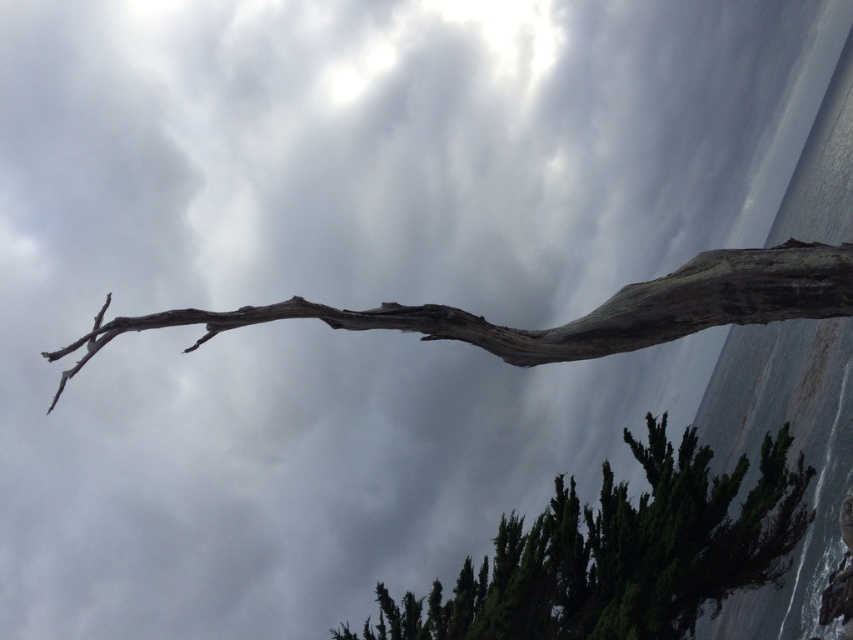
Between dark green leafy tree at lower right and gray rough bark branch at upper center, which one appears on the right side from the viewer's perspective?

gray rough bark branch at upper center

Is point (518, 580) closer to viewer compared to point (831, 250)?

No, (518, 580) is further to viewer.

Where is `dark green leafy tree at lower right`? The image size is (853, 640). dark green leafy tree at lower right is located at coordinates (622, 552).